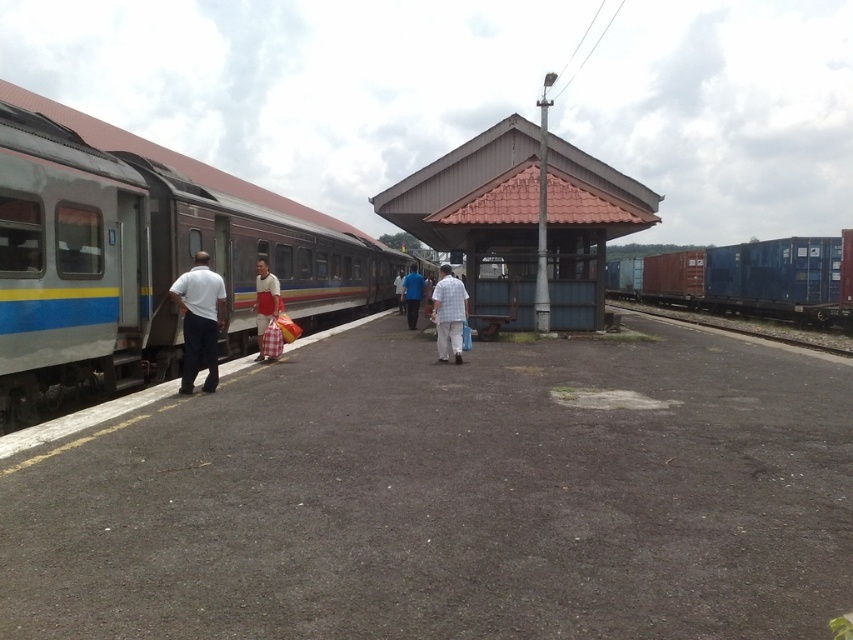
Consider the image. Is brown corrugated metal shelter at center behind white matte shirt at left?

Yes, brown corrugated metal shelter at center is further from the viewer.

Find the location of a particular element. Image resolution: width=853 pixels, height=640 pixels. brown corrugated metal shelter at center is located at coordinates (479, 212).

Based on the photo, who is positioned more to the right, white matte shirt at left or blue fabric shirt at center?

blue fabric shirt at center is more to the right.

The height and width of the screenshot is (640, 853). Find the location of `white matte shirt at left`. white matte shirt at left is located at coordinates (199, 321).

Is point (781, 310) positioned behind point (254, 316)?

Yes, it is.

Is the position of blue matte container at right more distant than that of white fabric bag at center?

Yes, blue matte container at right is behind white fabric bag at center.

Image resolution: width=853 pixels, height=640 pixels. Describe the element at coordinates (761, 278) in the screenshot. I see `blue matte container at right` at that location.

Locate an element on the screen. The image size is (853, 640). blue matte container at right is located at coordinates (761, 278).